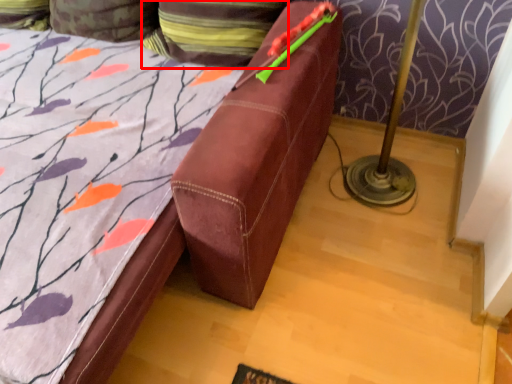
Question: From the image, what is the correct spatial relationship of pillow (annotated by the red box) in relation to pillow?

Choices:
 (A) right
 (B) left

Answer: (A)